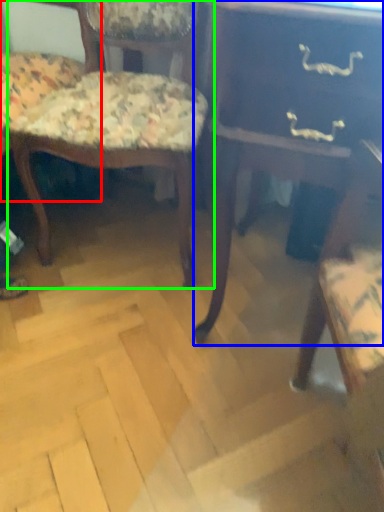
Question: Based on their relative distances, which object is farther from chair (highlighted by a red box)? Choose from table (highlighted by a blue box) and chair (highlighted by a green box).

Choices:
 (A) table
 (B) chair

Answer: (A)